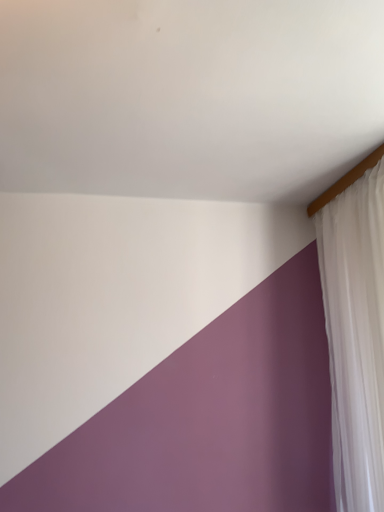
Question: Should I look upward or downward to see white sheer curtain at upper right?

Choices:
 (A) down
 (B) up

Answer: (A)